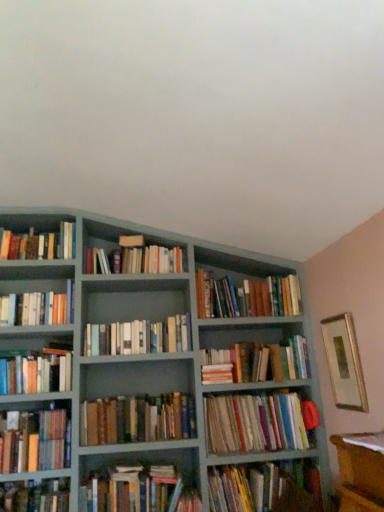
Question: Are hardcover books at center, the 5th book positioned from the top, and multicolored paperbacks at center, the 4th book positioned from the bottom, located far from each other?

Choices:
 (A) no
 (B) yes

Answer: (A)

Question: Can you see hardcover books at center, positioned as the ninth book in bottom-to-top order, touching multicolored paperbacks at center, the 4th book positioned from the bottom?

Choices:
 (A) no
 (B) yes

Answer: (A)

Question: Is hardcover books at center, the 5th book positioned from the top, bigger than multicolored paperbacks at center, which is counted as the tenth book, starting from the top?

Choices:
 (A) no
 (B) yes

Answer: (A)

Question: Is hardcover books at center, the 5th book positioned from the top, positioned before multicolored paperbacks at center, which is counted as the tenth book, starting from the top?

Choices:
 (A) no
 (B) yes

Answer: (A)

Question: Can you confirm if hardcover books at center, positioned as the ninth book in bottom-to-top order, is wider than multicolored paperbacks at center, which is counted as the tenth book, starting from the top?

Choices:
 (A) no
 (B) yes

Answer: (A)

Question: From the image's perspective, is hardcover books at left, which ranks as the seventh book in bottom-to-top order, located above or below hardcover books at center, which appears as the eleventh book when viewed from the top?

Choices:
 (A) below
 (B) above

Answer: (B)

Question: Looking at the image, does hardcover books at left, the seventh book positioned from the top, seem bigger or smaller compared to hardcover books at center, which appears as the eleventh book when viewed from the top?

Choices:
 (A) big
 (B) small

Answer: (B)

Question: Is hardcover books at left, which ranks as the seventh book in bottom-to-top order, situated inside hardcover books at center, the 3th book in the bottom-to-top sequence, or outside?

Choices:
 (A) inside
 (B) outside

Answer: (B)

Question: Is point (16, 390) closer or farther from the camera than point (196, 508)?

Choices:
 (A) farther
 (B) closer

Answer: (A)

Question: Looking at the image, does brown leather book at center, which is the 8th book in top-to-bottom order, seem bigger or smaller compared to hardcover books at upper left, which is counted as the 13th book, starting from the bottom?

Choices:
 (A) big
 (B) small

Answer: (A)

Question: Considering the positions of brown leather book at center, marked as the 6th book in a bottom-to-top arrangement, and hardcover books at upper left, which is counted as the 13th book, starting from the bottom, in the image, is brown leather book at center, marked as the 6th book in a bottom-to-top arrangement, taller or shorter than hardcover books at upper left, which is counted as the 13th book, starting from the bottom,?

Choices:
 (A) tall
 (B) short

Answer: (B)

Question: Considering their positions, is brown leather book at center, which is the 8th book in top-to-bottom order, located in front of or behind hardcover books at upper left, which is counted as the 1th book, starting from the top?

Choices:
 (A) front
 (B) behind

Answer: (A)

Question: Is brown leather book at center, which is the 8th book in top-to-bottom order, wider or thinner than hardcover books at upper left, which is counted as the 1th book, starting from the top?

Choices:
 (A) wide
 (B) thin

Answer: (B)

Question: Which is correct: hardcover books at center, the 5th book positioned from the top, is inside hardcover books at left, which is the fourth book in top-to-bottom order, or outside of it?

Choices:
 (A) outside
 (B) inside

Answer: (A)

Question: In the image, is hardcover books at center, positioned as the ninth book in bottom-to-top order, positioned in front of or behind hardcover books at left, which is the fourth book in top-to-bottom order?

Choices:
 (A) front
 (B) behind

Answer: (B)